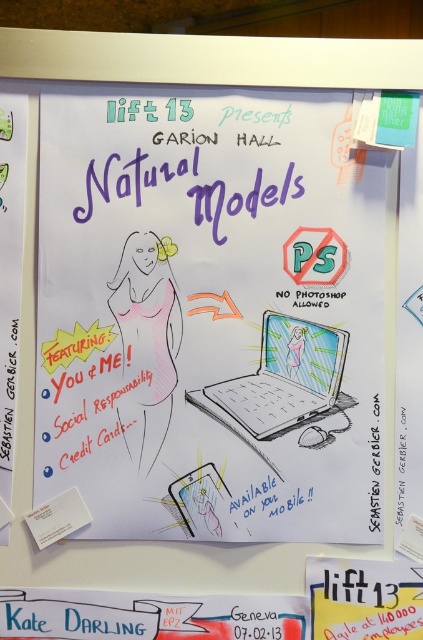
Who is more distant from viewer, [159,310] or [294,416]?

The point [159,310] is behind.

Is white paperboard at center below matte gray laptop at center?

No, white paperboard at center is not below matte gray laptop at center.

Between point (331, 378) and point (305, 378), which one is positioned behind?

The point (305, 378) is more distant.

What are the coordinates of `white paperboard at center` in the screenshot? It's located at coord(209,314).

From the picture: Can you confirm if pink paper-like at center is wider than matte gray laptop at center?

No.

Who is taller, pink paper-like at center or matte gray laptop at center?

With more height is pink paper-like at center.

Locate an element on the screen. The image size is (423, 640). pink paper-like at center is located at coordinates (145, 342).

You are a GUI agent. You are given a task and a screenshot of the screen. Output one action in this format:
    pyautogui.click(x=<x>, y=<y>)
    Task: Click on the pink paper-like at center
    
    Given the screenshot: What is the action you would take?
    pyautogui.click(x=145, y=342)

Looking at this image, which is below, white paperboard at center or white paper at center?

Positioned lower is white paper at center.

The height and width of the screenshot is (640, 423). I want to click on white paperboard at center, so click(x=209, y=314).